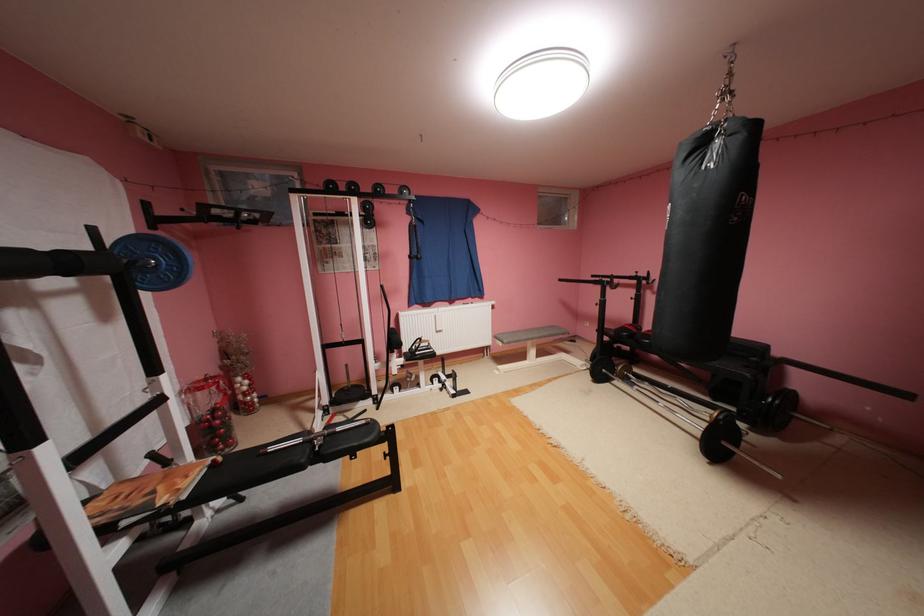
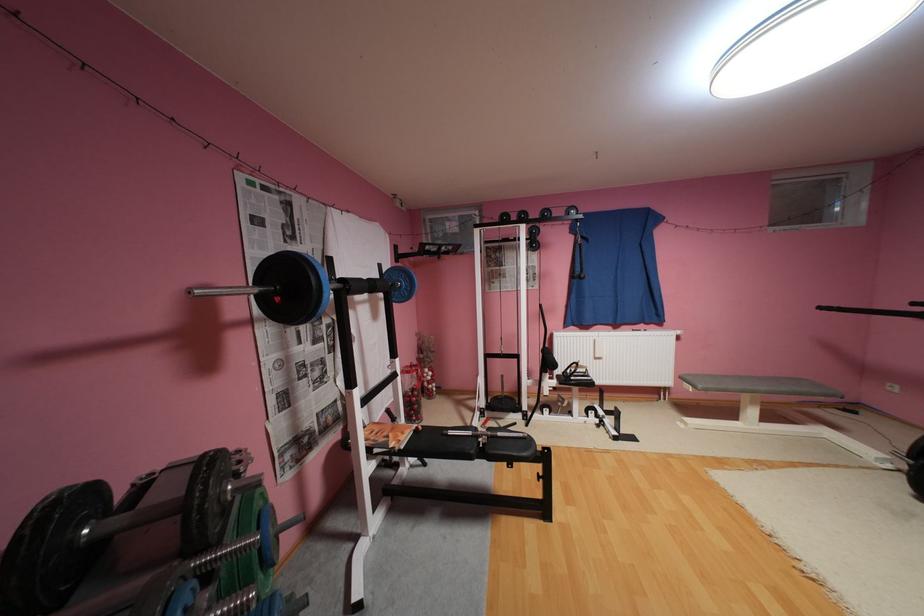
Where in the second image is the point corresponding to point 163,220 from the first image?

(407, 256)